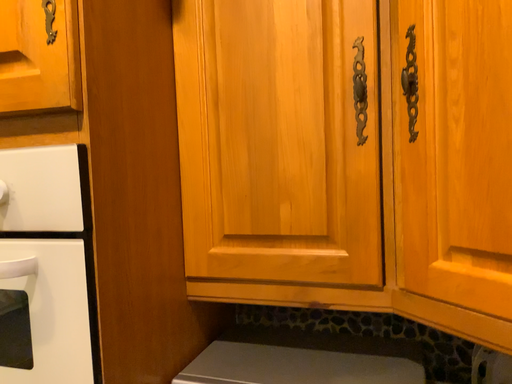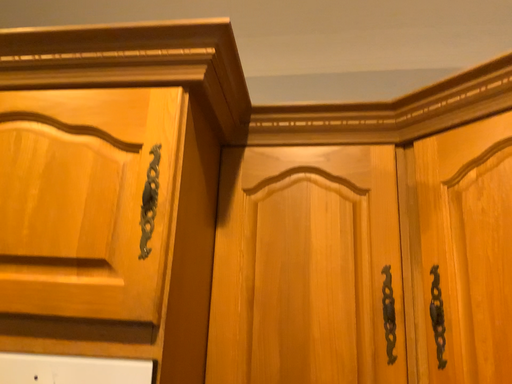
Question: How did the camera likely rotate when shooting the video?

Choices:
 (A) rotated upward
 (B) rotated downward

Answer: (A)